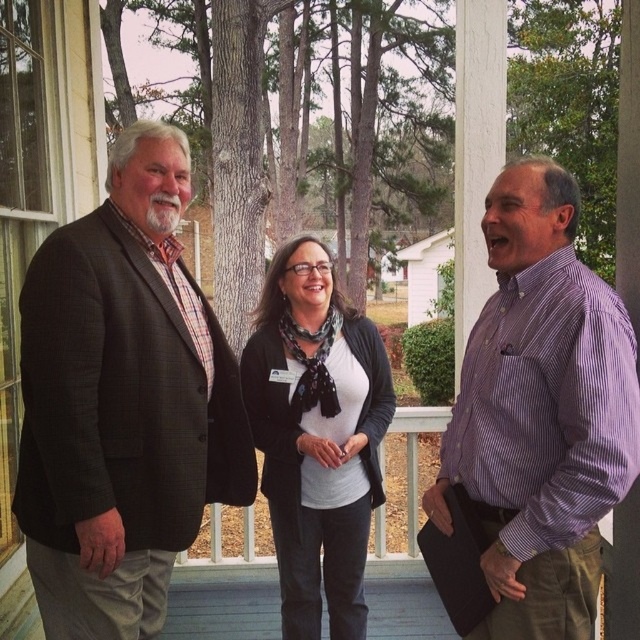
Does plaid fabric shirt at left lie in front of white matte shirt at center?

That is True.

What do you see at coordinates (122, 401) in the screenshot? This screenshot has width=640, height=640. I see `plaid fabric shirt at left` at bounding box center [122, 401].

Identify the location of plaid fabric shirt at left. (122, 401).

Which is more to the right, plaid fabric shirt at left or matte black briefcase at center?

matte black briefcase at center is more to the right.

Is plaid fabric shirt at left shorter than matte black briefcase at center?

Incorrect, plaid fabric shirt at left's height does not fall short of matte black briefcase at center's.

Locate an element on the screen. The image size is (640, 640). plaid fabric shirt at left is located at coordinates (122, 401).

Is point (250, 342) less distant than point (384, 515)?

Yes, point (250, 342) is closer to viewer.

Between point (378, 355) and point (204, 568), which one is positioned behind?

Positioned behind is point (204, 568).

Which is behind, point (285, 611) or point (378, 556)?

The point (378, 556) is behind.

This screenshot has height=640, width=640. I want to click on white matte shirt at center, so click(x=316, y=435).